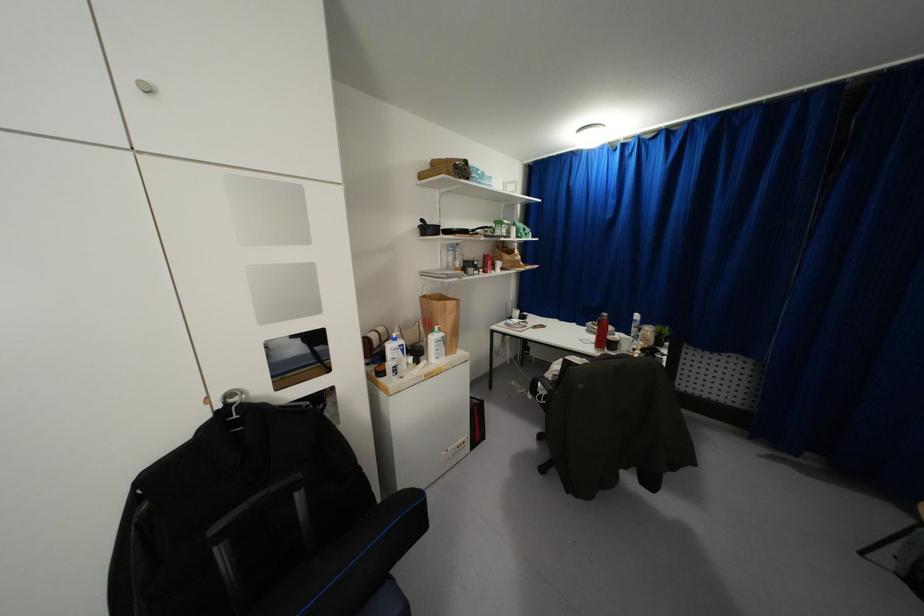
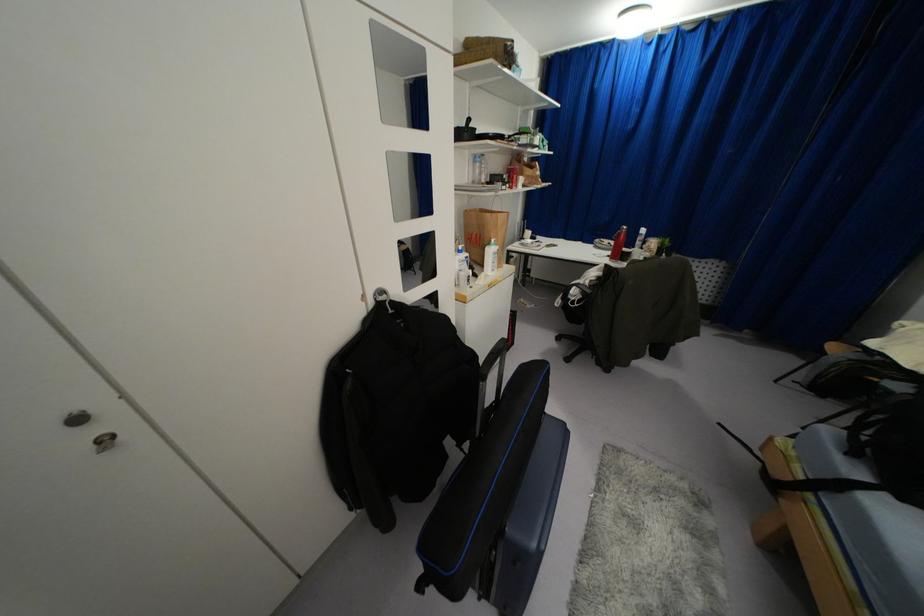
Find the pixel in the second image that matches the point at 442,333 in the first image.

(495, 246)